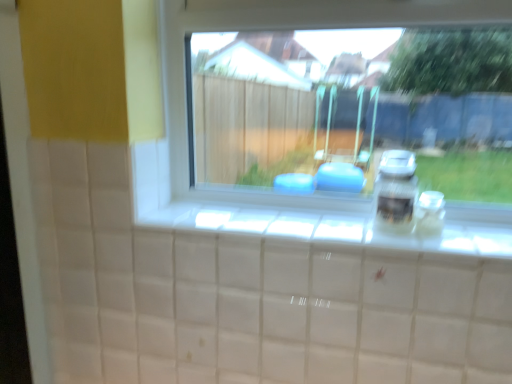
Find the location of a particular element. This screenshot has height=384, width=512. vacant region to the left of transparent glass jar at right is located at coordinates (368, 240).